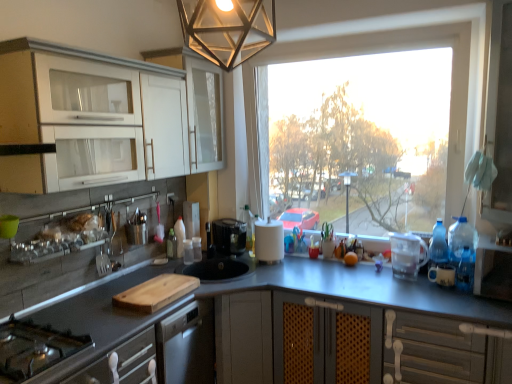
Question: Does translucent plastic bottle at center, the 2th bottle viewed from the left, have a greater height compared to transparent glass window at center?

Choices:
 (A) yes
 (B) no

Answer: (B)

Question: Is translucent plastic bottle at center, the first bottle viewed from the back, to the left of transparent glass window at center from the viewer's perspective?

Choices:
 (A) yes
 (B) no

Answer: (A)

Question: From the image's perspective, is translucent plastic bottle at center, which is the fourth bottle from front to back, under transparent glass window at center?

Choices:
 (A) yes
 (B) no

Answer: (A)

Question: Is translucent plastic bottle at center, the 2th bottle viewed from the left, behind transparent glass window at center?

Choices:
 (A) no
 (B) yes

Answer: (B)

Question: Does translucent plastic bottle at center, the 2th bottle viewed from the left, turn towards transparent glass window at center?

Choices:
 (A) yes
 (B) no

Answer: (A)

Question: Considering the positions of blue plastic water bottles at right, placed as the 3th appliance when sorted from left to right, and white plastic screen door at right in the image, is blue plastic water bottles at right, placed as the 3th appliance when sorted from left to right, wider or thinner than white plastic screen door at right?

Choices:
 (A) wide
 (B) thin

Answer: (B)

Question: Is blue plastic water bottles at right, placed as the 3th appliance when sorted from left to right, to the left or to the right of white plastic screen door at right in the image?

Choices:
 (A) left
 (B) right

Answer: (A)

Question: From the image's perspective, relative to white plastic screen door at right, is blue plastic water bottles at right, which appears as the first appliance when viewed from the right, above or below?

Choices:
 (A) above
 (B) below

Answer: (B)

Question: From a real-world perspective, relative to white plastic screen door at right, is blue plastic water bottles at right, which appears as the first appliance when viewed from the right, vertically above or below?

Choices:
 (A) above
 (B) below

Answer: (B)

Question: Considering the positions of point (192, 127) and point (457, 281), is point (192, 127) closer or farther from the camera than point (457, 281)?

Choices:
 (A) closer
 (B) farther

Answer: (B)

Question: Looking at their shapes, would you say white glossy cabinet at upper left, placed as the second cabinetry when sorted from front to back, is wider or thinner than blue translucent bottle at right, acting as the 1th bottle starting from the right?

Choices:
 (A) thin
 (B) wide

Answer: (B)

Question: Relative to blue translucent bottle at right, acting as the 1th bottle starting from the right, is white glossy cabinet at upper left, marked as the 1th cabinetry in a back-to-front arrangement, in front or behind?

Choices:
 (A) front
 (B) behind

Answer: (B)

Question: From a real-world perspective, is white glossy cabinet at upper left, placed as the second cabinetry when sorted from front to back, physically located above or below blue translucent bottle at right, which appears as the 4th bottle when viewed from the back?

Choices:
 (A) above
 (B) below

Answer: (A)

Question: From the image's perspective, is orange matte at counter positioned above or below wooden cutting board at center?

Choices:
 (A) below
 (B) above

Answer: (B)

Question: In terms of size, does orange matte at counter appear bigger or smaller than wooden cutting board at center?

Choices:
 (A) big
 (B) small

Answer: (B)